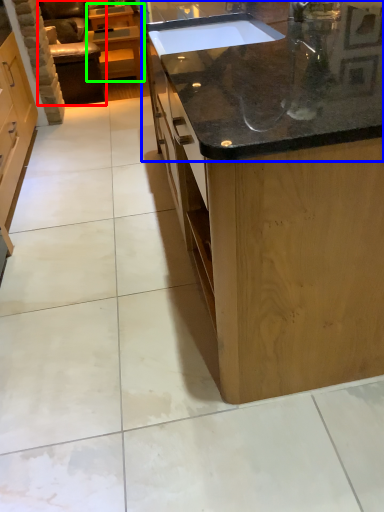
Question: Considering the real-world distances, which object is closest to armchair (highlighted by a red box)? countertop (highlighted by a blue box) or cabinetry (highlighted by a green box).

Choices:
 (A) countertop
 (B) cabinetry

Answer: (B)